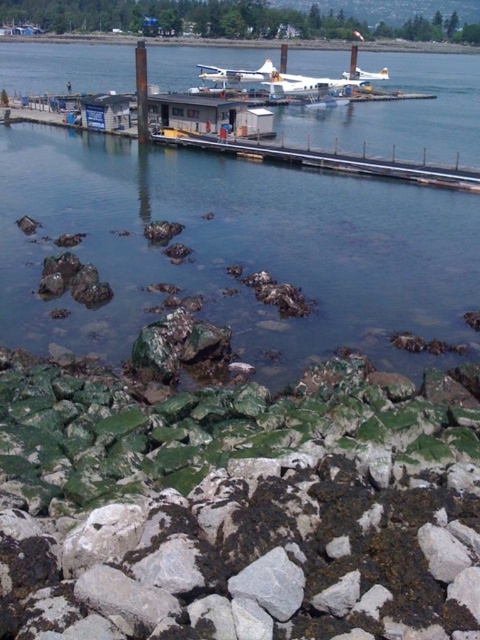
Question: Is the position of smooth concrete pier at upper center less distant than that of smooth concrete dock at upper center?

Choices:
 (A) yes
 (B) no

Answer: (A)

Question: From the image, what is the correct spatial relationship of clear water at center in relation to white matte airplane at upper center?

Choices:
 (A) below
 (B) above

Answer: (A)

Question: Is clear water at center below white matte seaplane at upper center?

Choices:
 (A) yes
 (B) no

Answer: (A)

Question: Which object is farther from the camera taking this photo?

Choices:
 (A) white matte seaplane at upper center
 (B) green mossy rocks at lower center

Answer: (A)

Question: Among these objects, which one is farthest from the camera?

Choices:
 (A) smooth concrete dock at upper center
 (B) white matte airplane at upper center

Answer: (A)

Question: Among these objects, which one is farthest from the camera?

Choices:
 (A) white matte seaplane at upper center
 (B) smooth concrete dock at upper center

Answer: (B)